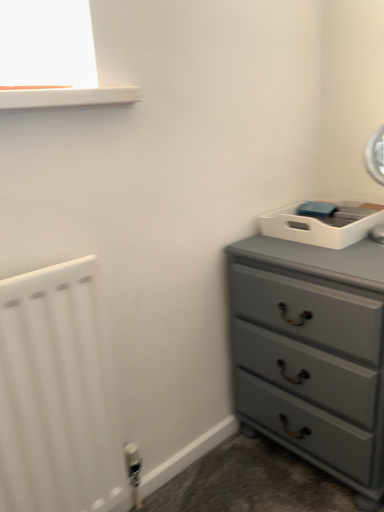
Question: Is white matte radiator at left situated inside matte gray dresser at right or outside?

Choices:
 (A) inside
 (B) outside

Answer: (B)

Question: Does point (69, 300) appear closer or farther from the camera than point (251, 348)?

Choices:
 (A) closer
 (B) farther

Answer: (A)

Question: In terms of height, does white matte radiator at left look taller or shorter compared to matte gray dresser at right?

Choices:
 (A) short
 (B) tall

Answer: (B)

Question: Relative to white matte radiator at left, is matte gray dresser at right in front or behind?

Choices:
 (A) front
 (B) behind

Answer: (B)

Question: From a real-world perspective, is matte gray dresser at right above or below white matte radiator at left?

Choices:
 (A) above
 (B) below

Answer: (B)

Question: Based on their positions, is matte gray dresser at right located to the left or right of white matte radiator at left?

Choices:
 (A) right
 (B) left

Answer: (A)

Question: In terms of height, does matte gray dresser at right look taller or shorter compared to white matte radiator at left?

Choices:
 (A) tall
 (B) short

Answer: (B)